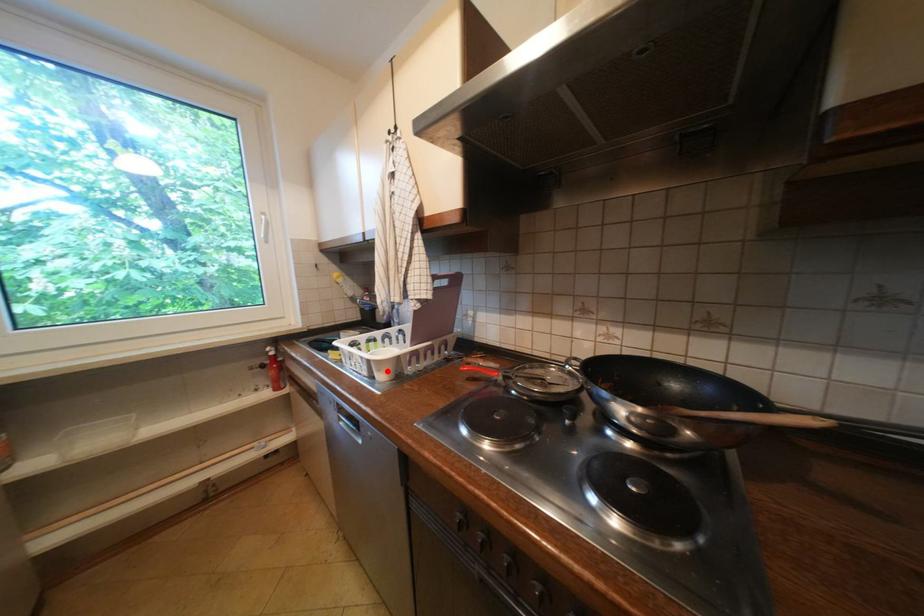
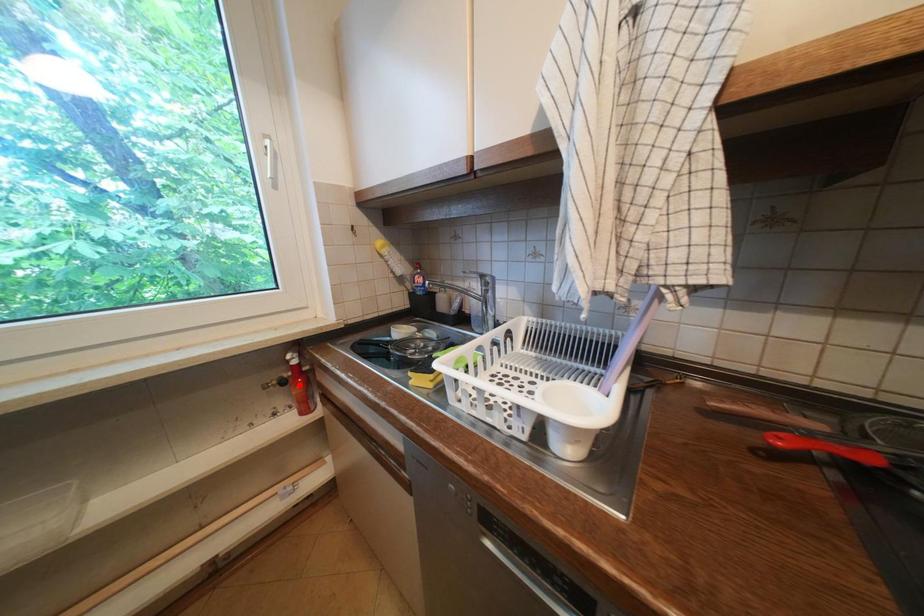
I am providing you with two images of the same scene from different viewpoints. A red point is marked on the first image and another point is marked on the second image. Are the points marked in image1 and image2 representing the same 3D position?

No